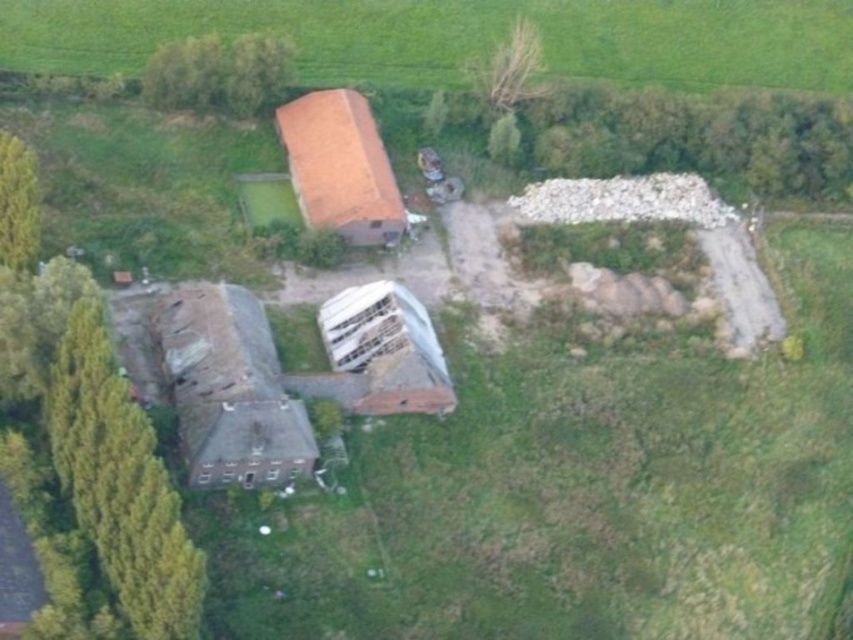
You are a drone operator flying over a rural area. Your mission is to capture images of the brown tile roof at center and the green leafy tree at lower left. From the perspective of the drone, which object is closer to the camera?

The brown tile roof at center is closer to the camera because the green leafy tree at lower left is behind it.

You are a landscape architect planning to plant a new tree in this rural area. You notice two green leafy trees already present. Which of the two existing trees, the green leafy tree at upper right or the green leafy tree at upper center, should you consider as the reference for spacing requirements due to its size?

The green leafy tree at upper right has a larger size compared to the green leafy tree at upper center, so you should consider it as the reference for spacing requirements due to its size.